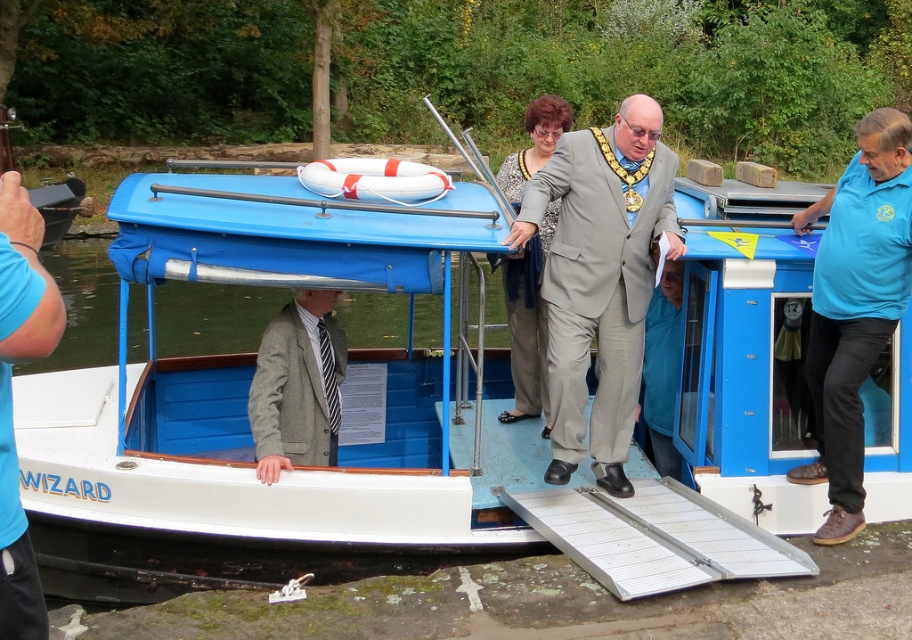
Question: Does blue wood boat at center have a smaller size compared to gray woolen blazer at center?

Choices:
 (A) yes
 (B) no

Answer: (A)

Question: Estimate the real-world distances between objects in this image. Which object is farther from the gray suit at center?

Choices:
 (A) gray fabric suit at center
 (B) gray woolen blazer at center
 (C) blue wood boat at center
 (D) blue cotton shirt at right

Answer: (C)

Question: Can you confirm if gray fabric suit at center is positioned to the right of blue wood boat at center?

Choices:
 (A) yes
 (B) no

Answer: (A)

Question: Which point is closer to the camera?

Choices:
 (A) gray fabric suit at center
 (B) gray suit at center
 (C) blue wood boat at center
 (D) gray woolen blazer at center

Answer: (A)

Question: Does gray woolen blazer at center have a larger size compared to gray suit at center?

Choices:
 (A) yes
 (B) no

Answer: (B)

Question: Considering the real-world distances, which object is farthest from the blue cotton shirt at right?

Choices:
 (A) gray woolen blazer at center
 (B) gray fabric suit at center
 (C) gray suit at center

Answer: (C)